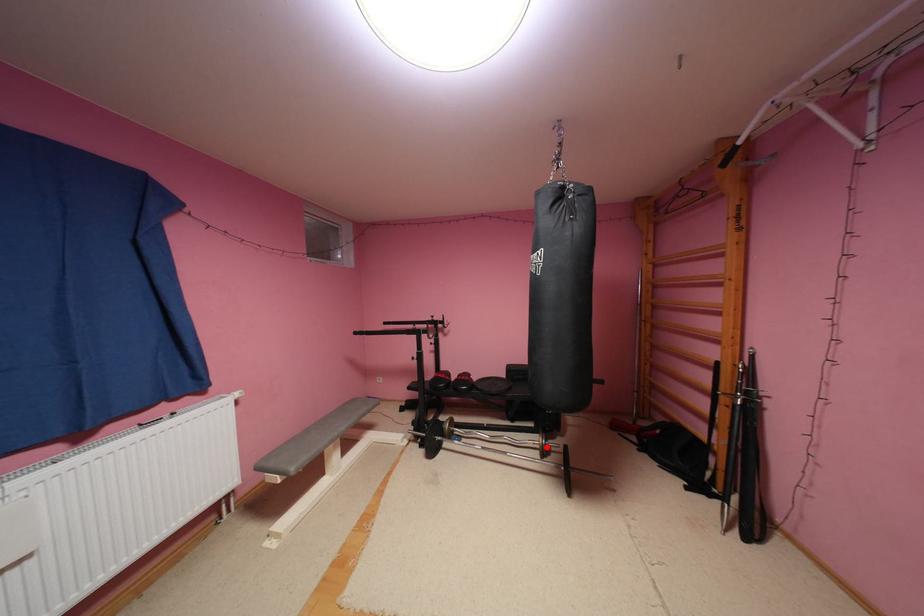
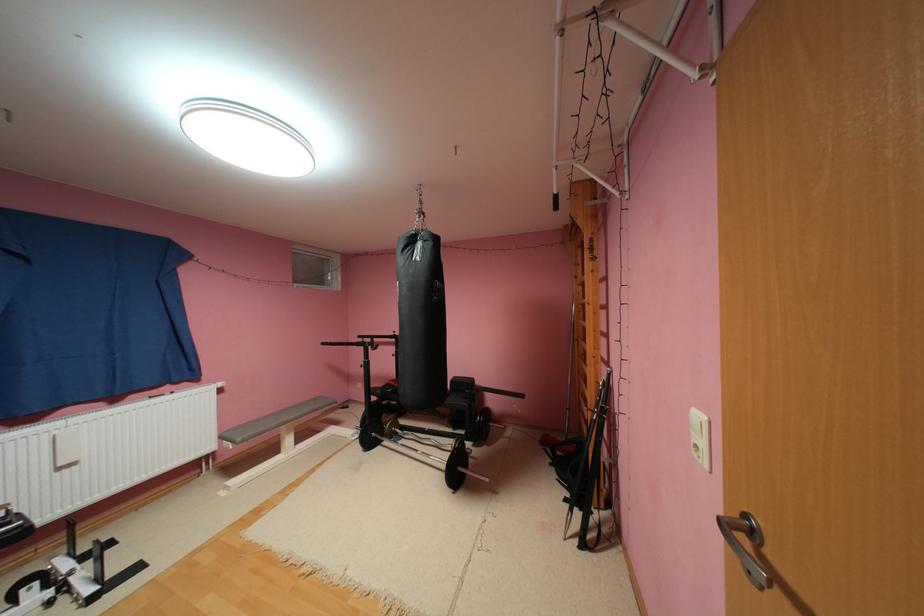
Find the pixel in the second image that matches the highlighted location in the first image.

(458, 450)